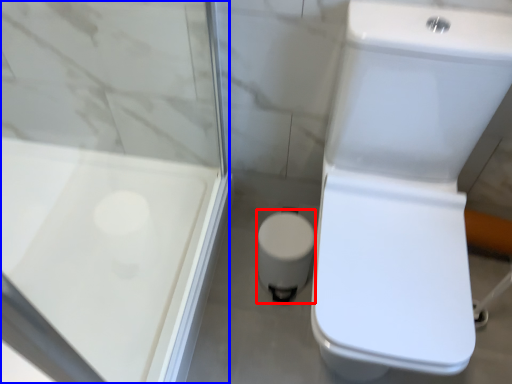
Question: Which object appears closest to the camera in this image, porcelain (highlighted by a red box) or screen door (highlighted by a blue box)?

Choices:
 (A) porcelain
 (B) screen door

Answer: (B)